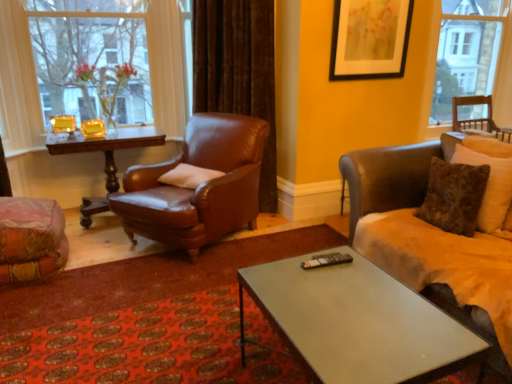
Locate an element on the screen. This screenshot has width=512, height=384. vacant space to the right of black plastic remote control at center is located at coordinates [361, 266].